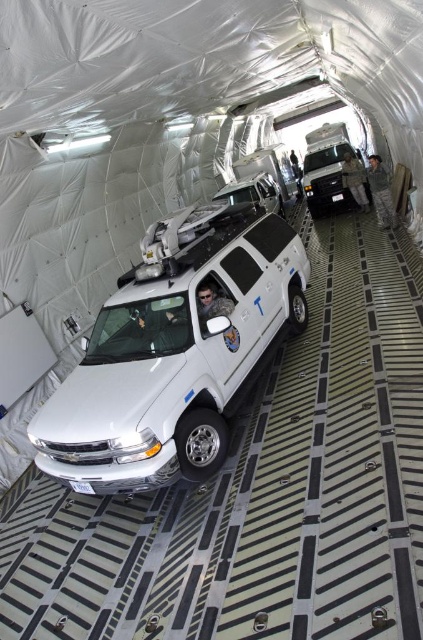
Question: Which point is closer to the camera taking this photo?

Choices:
 (A) (307, 198)
 (B) (249, 218)

Answer: (B)

Question: Which of the following is the closest to the observer?

Choices:
 (A) white matte van at center
 (B) white glossy minivan at center

Answer: (B)

Question: Does white glossy minivan at center have a smaller size compared to white matte van at center?

Choices:
 (A) no
 (B) yes

Answer: (B)

Question: Is white glossy minivan at center further to camera compared to white matte van at center?

Choices:
 (A) yes
 (B) no

Answer: (B)

Question: From the image, what is the correct spatial relationship of white glossy minivan at center in relation to white matte van at center?

Choices:
 (A) right
 (B) left

Answer: (B)